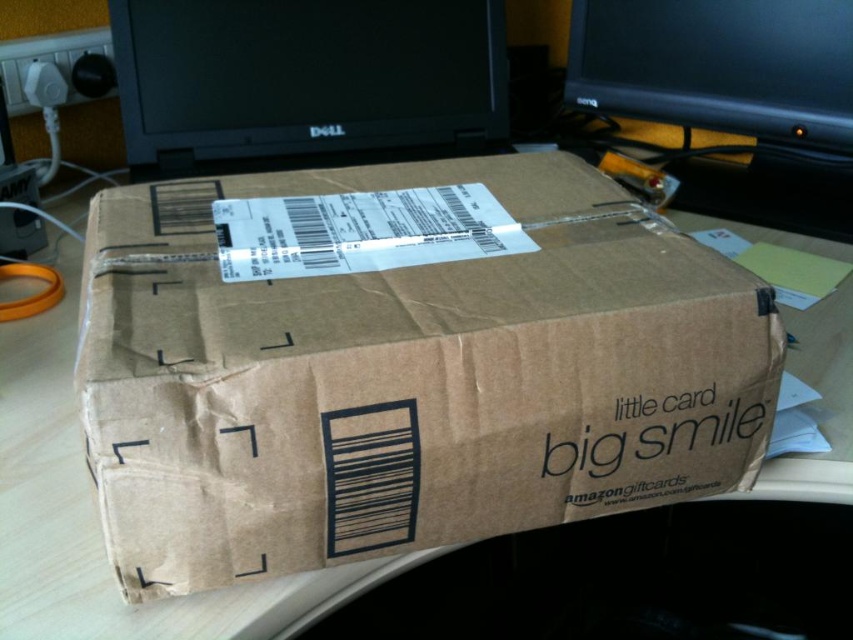
Question: Which object appears farthest from the camera in this image?

Choices:
 (A) black glossy monitor at upper center
 (B) black glossy monitor at upper right
 (C) brown cardboard box at center

Answer: (A)

Question: Which point is closer to the camera taking this photo?

Choices:
 (A) 599,65
 (B) 236,195

Answer: (B)

Question: Can you confirm if black glossy monitor at upper center is positioned to the right of black glossy monitor at upper right?

Choices:
 (A) no
 (B) yes

Answer: (A)

Question: Does black glossy monitor at upper center have a greater width compared to black glossy monitor at upper right?

Choices:
 (A) yes
 (B) no

Answer: (A)

Question: Does brown cardboard box at center have a smaller size compared to black glossy monitor at upper center?

Choices:
 (A) no
 (B) yes

Answer: (A)

Question: Which object is the farthest from the brown cardboard box at center?

Choices:
 (A) black glossy monitor at upper right
 (B) black glossy monitor at upper center

Answer: (A)